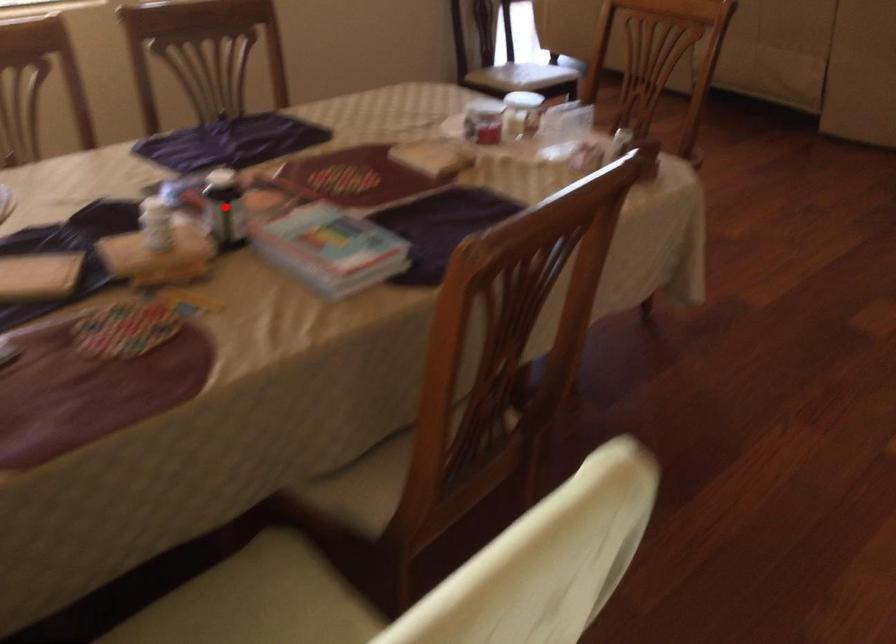
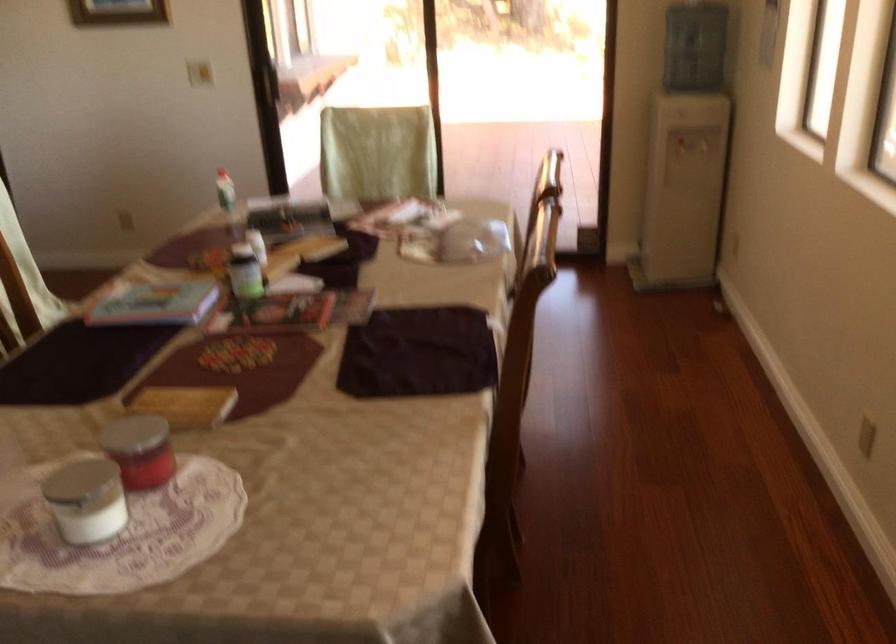
Question: I am providing you with two images of the same scene from different viewpoints. Image1 has a red point marked. In image2, the corresponding 3D location appears at what relative position? Reply with the corresponding letter.

Choices:
 (A) Closer
 (B) Farther

Answer: (B)